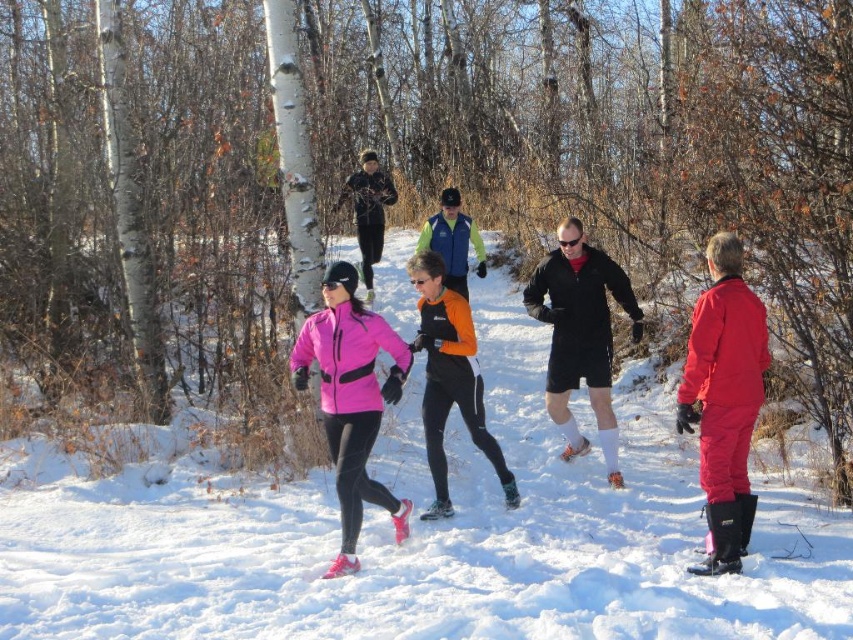
You are standing at the point marked as point (x=419, y=534) in the image. What do you see directly below you?

You see white fluffy snow at center directly below point (x=419, y=534).

You are planning to take a photo of the white fluffy snow at center and the black matte shorts at center. Which object is lower in height?

The white fluffy snow at center has a lesser height compared to black matte shorts at center, so the white fluffy snow at center is lower in height.